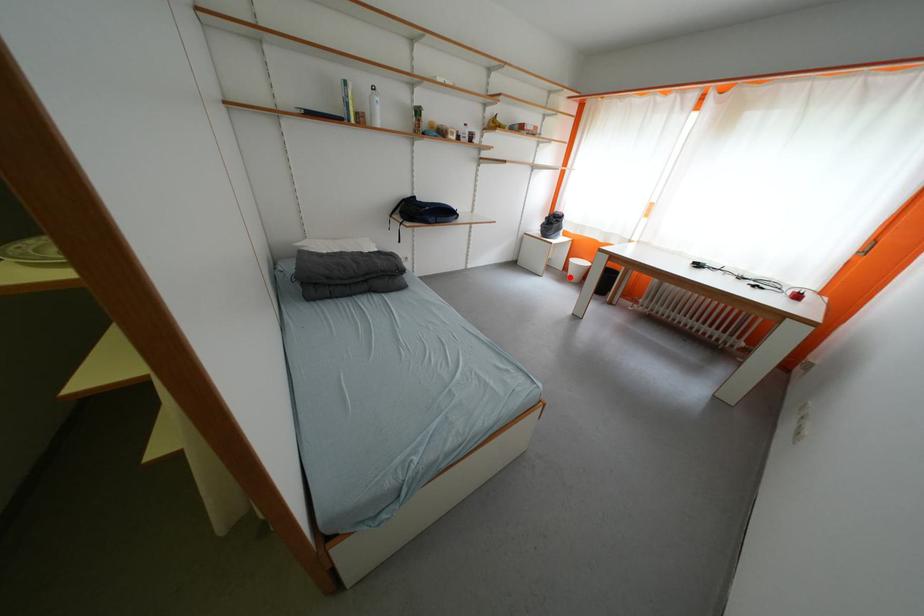
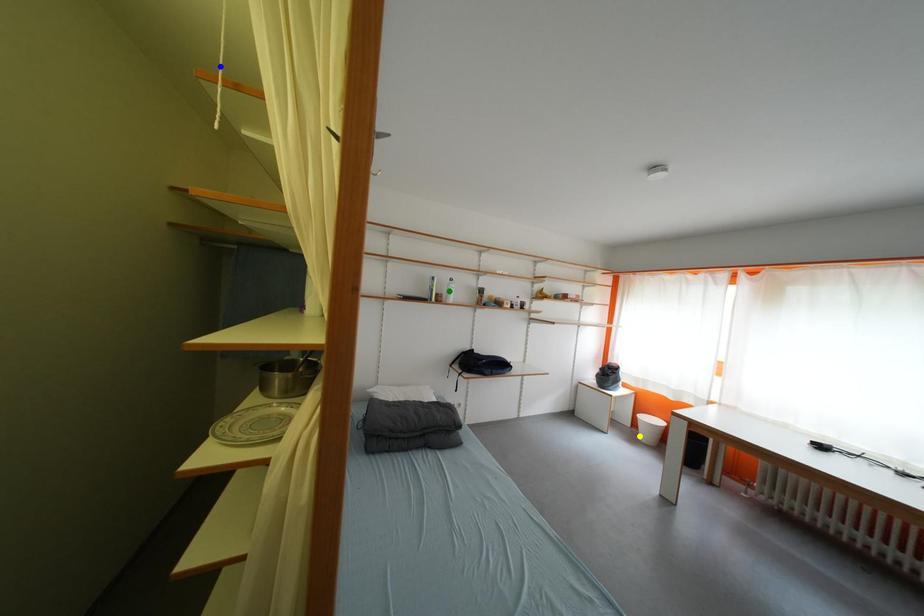
Question: I am providing you with two images of the same scene from different viewpoints. A red point is marked on the first image. You are given multiple points on the second image. Which spot in image 2 lines up with the point in image 1?

Choices:
 (A) yellow point
 (B) blue point
 (C) green point

Answer: (A)